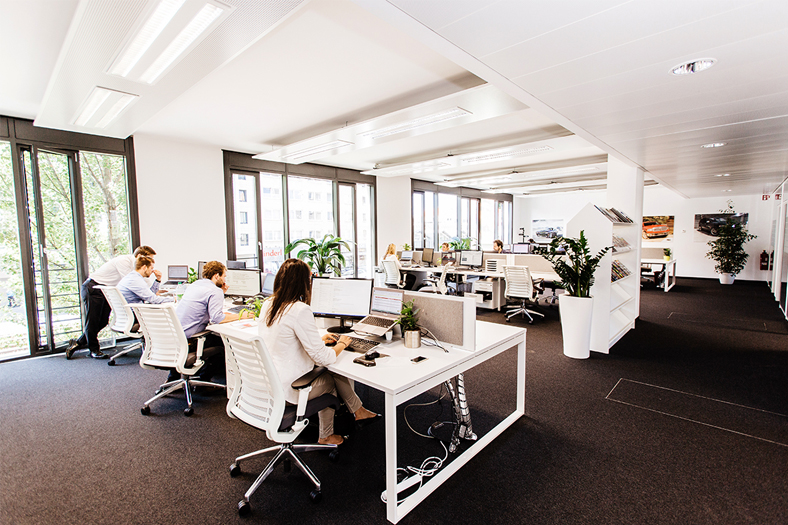
You are a GUI agent. You are given a task and a screenshot of the screen. Output one action in this format:
    pyautogui.click(x=<x>, y=<y>)
    Task: Click on the desk
    
    Given the screenshot: What is the action you would take?
    point(400,381), point(488,331), point(238,302), point(418,266), point(545,273), point(656,258)